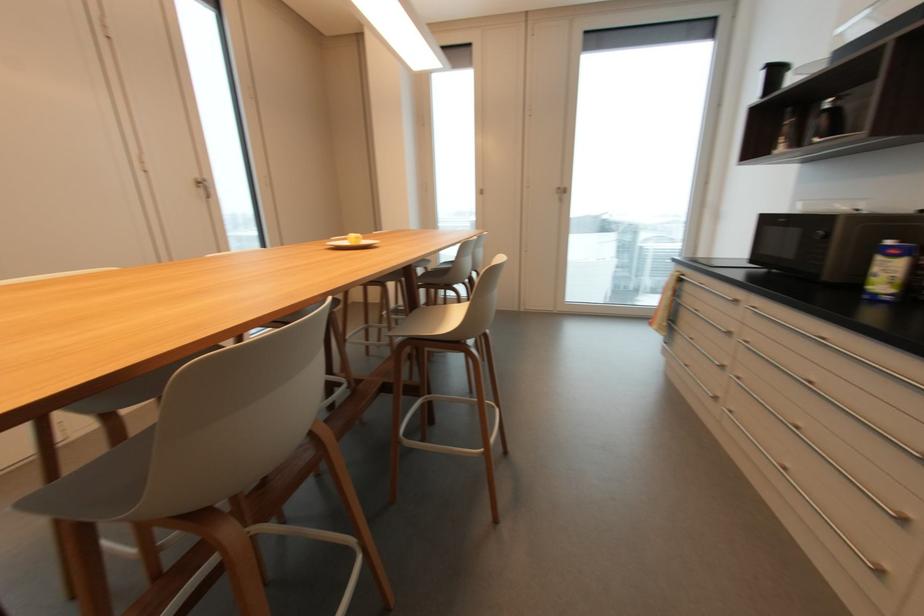
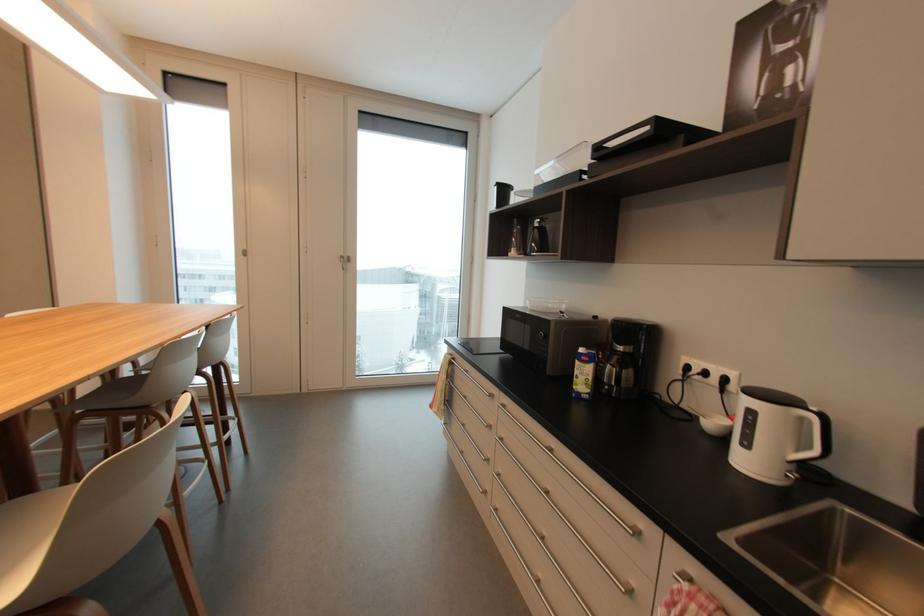
Question: The images are taken continuously from a first-person perspective. In which direction is your viewpoint rotating?

Choices:
 (A) Left
 (B) Right
 (C) Up
 (D) Down

Answer: (B)